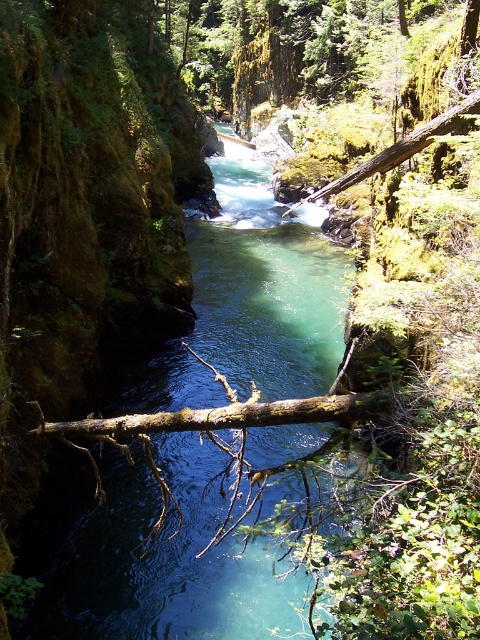
Question: Is clear water at center wider than brown rough log at center?

Choices:
 (A) yes
 (B) no

Answer: (A)

Question: Where is clear water at center located in relation to brown rough log at center in the image?

Choices:
 (A) left
 (B) right

Answer: (B)

Question: Among these points, which one is nearest to the camera?

Choices:
 (A) (99, 422)
 (B) (219, 268)

Answer: (A)

Question: Which of the following is the farthest from the observer?

Choices:
 (A) clear water at center
 (B) brown rough log at center

Answer: (A)

Question: Can you confirm if clear water at center is wider than brown rough log at center?

Choices:
 (A) yes
 (B) no

Answer: (A)